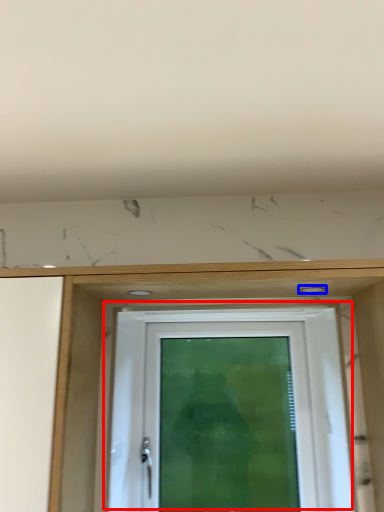
Question: Which object is further to the camera taking this photo, door (highlighted by a red box) or hole (highlighted by a blue box)?

Choices:
 (A) door
 (B) hole

Answer: (A)